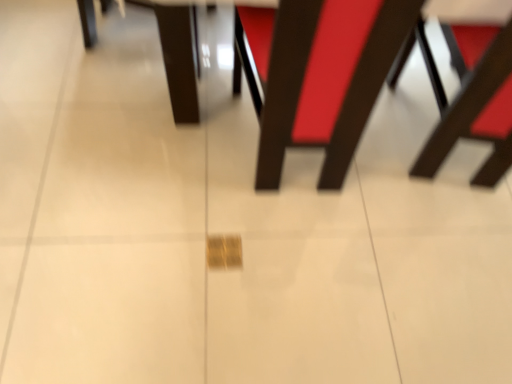
Question: Is matte brown chair at center, the 1th chair in the left-to-right sequence, not inside wooden chair at right, the 1th chair viewed from the right?

Choices:
 (A) yes
 (B) no

Answer: (A)

Question: Is matte brown chair at center, the 2th chair viewed from the right, positioned with its back to wooden chair at right, the 1th chair viewed from the right?

Choices:
 (A) yes
 (B) no

Answer: (B)

Question: Could wooden chair at right, the 1th chair viewed from the right, be considered to be inside matte brown chair at center, the 2th chair viewed from the right?

Choices:
 (A) yes
 (B) no

Answer: (B)

Question: From a real-world perspective, is matte brown chair at center, the 2th chair viewed from the right, physically above wooden chair at right, marked as the second chair in a left-to-right arrangement?

Choices:
 (A) no
 (B) yes

Answer: (B)

Question: Does matte brown chair at center, the 1th chair in the left-to-right sequence, turn towards wooden chair at right, marked as the second chair in a left-to-right arrangement?

Choices:
 (A) no
 (B) yes

Answer: (A)

Question: Is matte brown chair at center, the 1th chair in the left-to-right sequence, closer to camera compared to wooden chair at right, the 1th chair viewed from the right?

Choices:
 (A) yes
 (B) no

Answer: (A)

Question: Does wooden chair at right, marked as the second chair in a left-to-right arrangement, appear on the left side of matte brown chair at center, the 1th chair in the left-to-right sequence?

Choices:
 (A) yes
 (B) no

Answer: (B)

Question: Could you tell me if wooden chair at right, the 1th chair viewed from the right, is facing matte brown chair at center, the 2th chair viewed from the right?

Choices:
 (A) yes
 (B) no

Answer: (B)

Question: Would you consider wooden chair at right, the 1th chair viewed from the right, to be distant from matte brown chair at center, the 2th chair viewed from the right?

Choices:
 (A) no
 (B) yes

Answer: (A)

Question: Can matte brown chair at center, the 2th chair viewed from the right, be found inside wooden chair at right, marked as the second chair in a left-to-right arrangement?

Choices:
 (A) no
 (B) yes

Answer: (A)

Question: Is wooden chair at right, the 1th chair viewed from the right, taller than matte brown chair at center, the 2th chair viewed from the right?

Choices:
 (A) yes
 (B) no

Answer: (B)

Question: Does wooden chair at right, the 1th chair viewed from the right, have a smaller size compared to matte brown chair at center, the 1th chair in the left-to-right sequence?

Choices:
 (A) no
 (B) yes

Answer: (B)

Question: Is point (365, 82) closer or farther from the camera than point (458, 115)?

Choices:
 (A) closer
 (B) farther

Answer: (A)